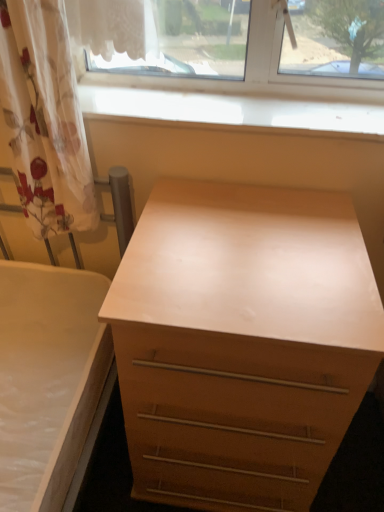
Question: From the image's perspective, is light wood chest of drawers at center above or below smooth wood window sill at upper center?

Choices:
 (A) below
 (B) above

Answer: (A)

Question: In terms of width, does light wood chest of drawers at center look wider or thinner when compared to smooth wood window sill at upper center?

Choices:
 (A) wide
 (B) thin

Answer: (A)

Question: Which of these objects is positioned farthest from the translucent floral fabric at left?

Choices:
 (A) smooth wood window sill at upper center
 (B) light wood chest of drawers at center

Answer: (B)

Question: Which of these objects is positioned farthest from the light wood chest of drawers at center?

Choices:
 (A) smooth wood window sill at upper center
 (B) translucent floral fabric at left

Answer: (A)